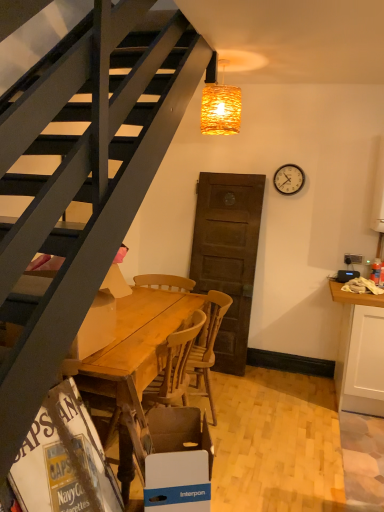
Question: Is wooden table at center behind blue cardboard box at lower center, the 1th box from the right?

Choices:
 (A) yes
 (B) no

Answer: (A)

Question: Is wooden table at center surrounding blue cardboard box at lower center, the 2th box in the top-to-bottom sequence?

Choices:
 (A) yes
 (B) no

Answer: (B)

Question: From the image's perspective, would you say wooden table at center is positioned over blue cardboard box at lower center, the 1th box from the bottom?

Choices:
 (A) no
 (B) yes

Answer: (B)

Question: Is wooden table at center at the left side of blue cardboard box at lower center, the 2th box in the top-to-bottom sequence?

Choices:
 (A) yes
 (B) no

Answer: (A)

Question: Is wooden table at center turned away from blue cardboard box at lower center, the 1th box from the bottom?

Choices:
 (A) yes
 (B) no

Answer: (B)

Question: Can you confirm if wooden table at center is smaller than blue cardboard box at lower center, positioned as the second box in left-to-right order?

Choices:
 (A) no
 (B) yes

Answer: (A)

Question: Is woven wicker lampshade at upper center closer to the viewer compared to blue cardboard box at lower center, the 1th box from the bottom?

Choices:
 (A) yes
 (B) no

Answer: (B)

Question: Can you confirm if woven wicker lampshade at upper center is bigger than blue cardboard box at lower center, positioned as the second box in left-to-right order?

Choices:
 (A) no
 (B) yes

Answer: (A)

Question: Does woven wicker lampshade at upper center contain blue cardboard box at lower center, the 1th box from the bottom?

Choices:
 (A) no
 (B) yes

Answer: (A)

Question: Can you confirm if woven wicker lampshade at upper center is taller than blue cardboard box at lower center, positioned as the second box in left-to-right order?

Choices:
 (A) yes
 (B) no

Answer: (B)

Question: Could you tell me if woven wicker lampshade at upper center is turned towards blue cardboard box at lower center, the 1th box from the bottom?

Choices:
 (A) yes
 (B) no

Answer: (B)

Question: Can you confirm if woven wicker lampshade at upper center is wider than blue cardboard box at lower center, the 2th box in the top-to-bottom sequence?

Choices:
 (A) yes
 (B) no

Answer: (B)

Question: From a real-world perspective, is white cardboard magazine at lower left below woven wicker lampshade at upper center?

Choices:
 (A) yes
 (B) no

Answer: (A)